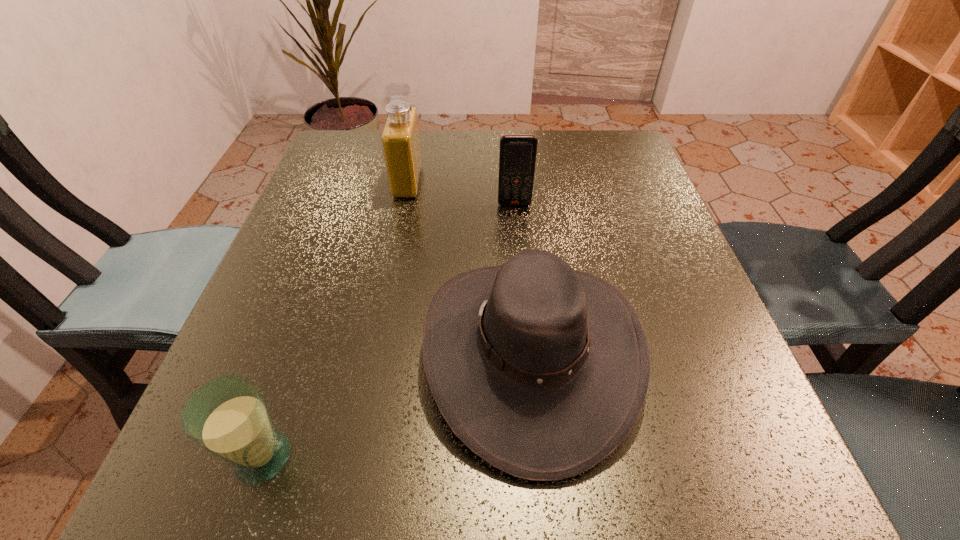
The height and width of the screenshot is (540, 960). Identify the location of free space at the right edge of the desktop. (587, 186).

Find the location of a particular element. The height and width of the screenshot is (540, 960). vacant space at the far left corner of the desktop is located at coordinates (376, 148).

The width and height of the screenshot is (960, 540). I want to click on vacant space at the near left corner, so click(x=241, y=511).

In the image, there is a desktop. Where is `vacant space at the far right corner`? This screenshot has width=960, height=540. vacant space at the far right corner is located at coordinates (608, 153).

In the image, there is a desktop. Identify the location of blank space at the near right corner. The height and width of the screenshot is (540, 960). (758, 517).

Locate an element on the screen. vacant space in between the cowboy hat and the perfume is located at coordinates (469, 267).

Locate an element on the screen. Image resolution: width=960 pixels, height=540 pixels. vacant space that is in between the cowboy hat and the perfume is located at coordinates (469, 267).

At what (x,y) coordinates should I click in order to perform the action: click on vacant space that is in between the tallest object and the cowboy hat. Please return your answer as a coordinate pair (x, y). Looking at the image, I should click on (469, 267).

I want to click on free space between the farthest object and the cellular telephone, so click(461, 193).

Locate an element on the screen. Image resolution: width=960 pixels, height=540 pixels. vacant area that lies between the farthest object and the glass is located at coordinates (335, 320).